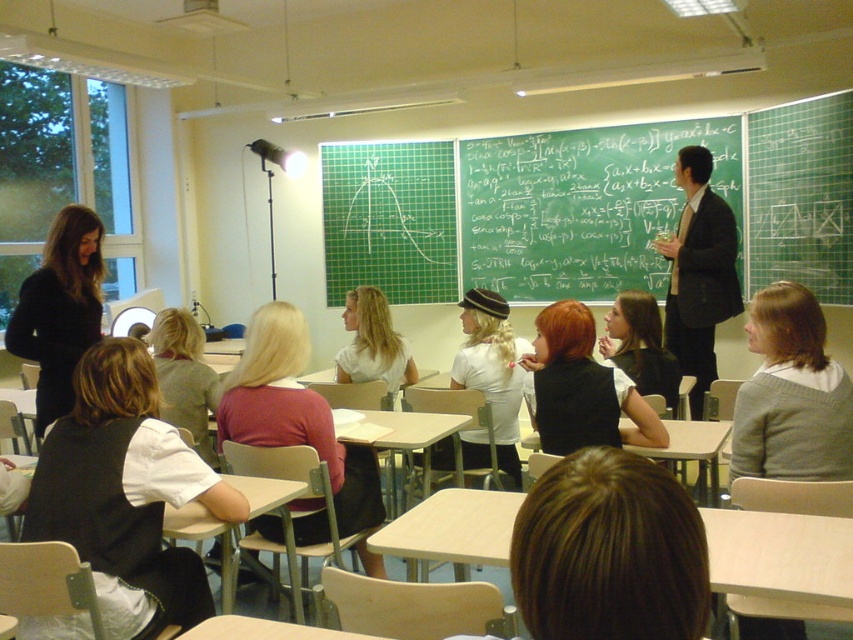
Is green chalkboard at upper center wider than black suit at center?

Indeed, green chalkboard at upper center has a greater width compared to black suit at center.

Is point (740, 232) behind point (694, 403)?

Yes, it is.

Does point (480, 244) lie behind point (705, 160)?

Yes.

The width and height of the screenshot is (853, 640). Identify the location of green chalkboard at upper center. point(581,205).